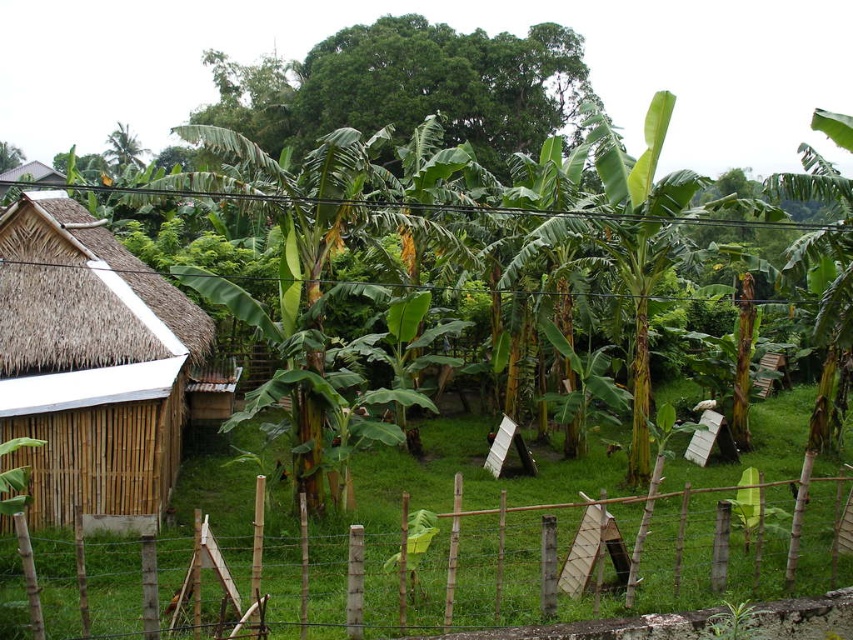
Question: Is bamboo fence at center further to camera compared to bamboo-thatched hut at left?

Choices:
 (A) yes
 (B) no

Answer: (B)

Question: Does bamboo fence at center have a greater width compared to thatched bamboo hut at left?

Choices:
 (A) no
 (B) yes

Answer: (A)

Question: In this image, where is bamboo-thatched hut at left located relative to thatched bamboo hut at left?

Choices:
 (A) above
 (B) below

Answer: (B)

Question: Which object is farther from the camera taking this photo?

Choices:
 (A) bamboo-thatched hut at left
 (B) thatched bamboo hut at left

Answer: (B)

Question: Among these points, which one is farthest from the camera?

Choices:
 (A) (294, 584)
 (B) (105, 404)
 (C) (56, 180)

Answer: (C)

Question: Which point is farther from the camera taking this photo?

Choices:
 (A) (44, 179)
 (B) (187, 310)
 (C) (257, 618)

Answer: (A)